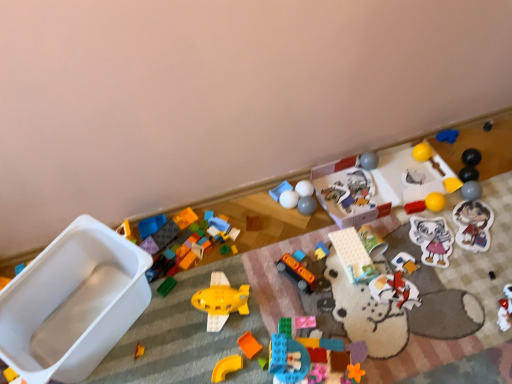
Locate an element on the screen. This screenshot has height=384, width=512. vacant space to the right of matte gray ball at right, the 2th toy from the right is located at coordinates (493, 197).